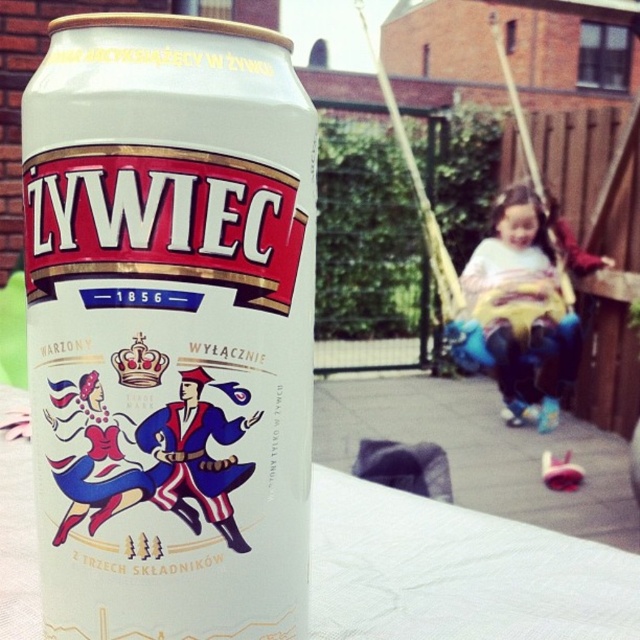
You are at a picnic and see the white matte beer can at center and the light blue denim jeans at lower right. Which object is positioned more to the right?

The light blue denim jeans at lower right are positioned more to the right than the white matte beer can at center.